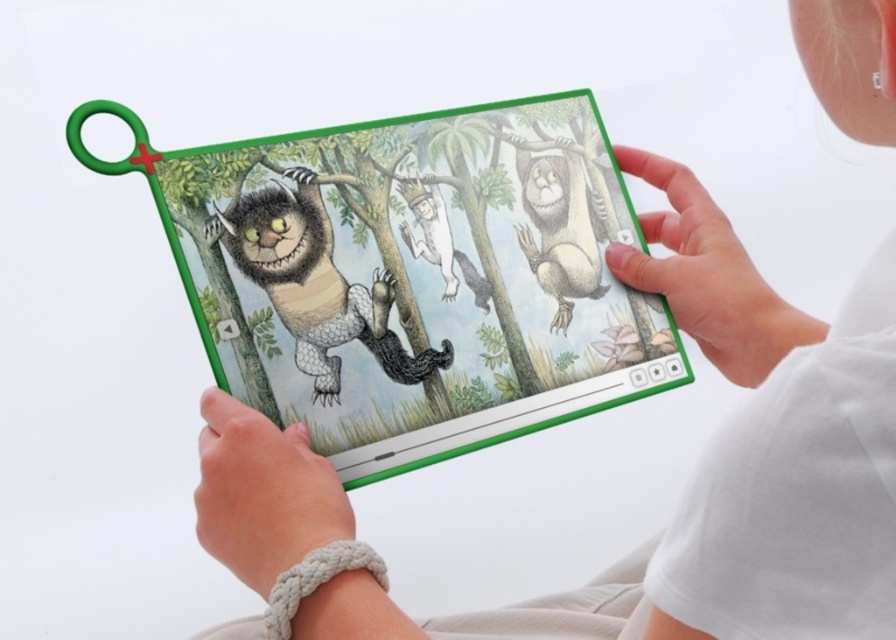
You are an artist trying to draw the scene on the tablet. You notice the white matte hand at upper right and the brown furry sloth at right. Which object should you draw first if you want to start with the larger one?

The white matte hand at upper right should be drawn first because it is larger than the brown furry sloth at right according to the description.

You are an art student analyzing the tablet illustration. You notice the white matte hand at upper right and the brown furry sloth at right. Which object is positioned more to the right in the illustration?

The white matte hand at upper right is positioned more to the right than the brown furry sloth at right according to the illustration details.

You are a child trying to reach the white paper crown at center on the tablet screen. There is a white matte hand at lower center in the image. Can you tell me if the hand is blocking your view of the crown?

The white matte hand at lower center is in front of the white paper crown at center, so yes, the hand is blocking the view of the crown.